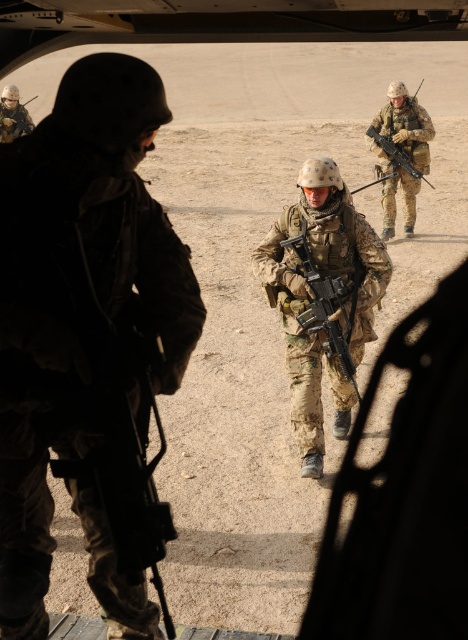
Between camouflage fabric uniform at center and matte black helmet at upper left, which one has more height?

Standing taller between the two is camouflage fabric uniform at center.

Can you confirm if camouflage fabric uniform at center is positioned to the left of matte black helmet at upper left?

Incorrect, camouflage fabric uniform at center is not on the left side of matte black helmet at upper left.

This screenshot has height=640, width=468. Identify the location of camouflage fabric uniform at center. (322, 298).

Between point (103, 84) and point (394, 198), which one is positioned in front?

Point (103, 84) is more forward.

Does camouflage uniform at center appear over camouflage fabric rifle at center?

No, camouflage uniform at center is not above camouflage fabric rifle at center.

At what (x,y) coordinates should I click in order to perform the action: click on camouflage uniform at center. Please return your answer as a coordinate pair (x, y). The image size is (468, 640). Looking at the image, I should click on (87, 339).

Where is `camouflage uniform at center`? Image resolution: width=468 pixels, height=640 pixels. camouflage uniform at center is located at coordinates (87, 339).

Can you confirm if camouflage-patterned rifle at center is positioned to the left of matte black rifle at center?

Indeed, camouflage-patterned rifle at center is positioned on the left side of matte black rifle at center.

You are a GUI agent. You are given a task and a screenshot of the screen. Output one action in this format:
    pyautogui.click(x=<x>, y=<y>)
    Task: Click on the camouflage-patterned rifle at center
    This screenshot has height=640, width=468.
    Given the screenshot: What is the action you would take?
    [x=328, y=304]

Which is in front, point (308, 316) or point (404, 154)?

Positioned in front is point (308, 316).

Identify the location of camouflage-patterned rifle at center. This screenshot has width=468, height=640. point(328,304).